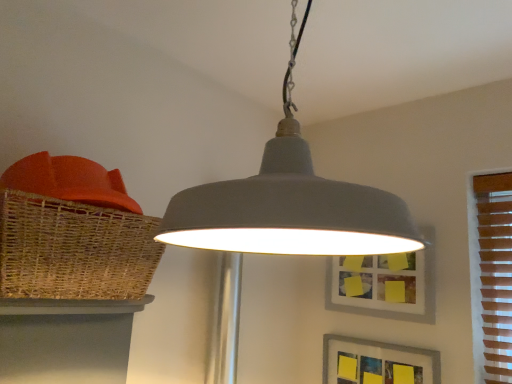
Question: Can you confirm if matte wicker table at lower left is bigger than matte gray picture frame at center, the 1th picture frame from the top?

Choices:
 (A) yes
 (B) no

Answer: (A)

Question: Is matte wicker table at lower left looking in the opposite direction of matte gray picture frame at center, the 1th picture frame from the top?

Choices:
 (A) yes
 (B) no

Answer: (B)

Question: From a real-world perspective, does matte wicker table at lower left stand above matte gray picture frame at center, the 1th picture frame from the top?

Choices:
 (A) no
 (B) yes

Answer: (A)

Question: Does matte wicker table at lower left touch matte gray picture frame at center, the second picture frame in the bottom-to-top sequence?

Choices:
 (A) yes
 (B) no

Answer: (B)

Question: Can you confirm if matte wicker table at lower left is thinner than matte gray picture frame at center, the second picture frame in the bottom-to-top sequence?

Choices:
 (A) yes
 (B) no

Answer: (B)

Question: Is the position of matte wicker table at lower left more distant than that of matte gray picture frame at center, the 1th picture frame from the top?

Choices:
 (A) yes
 (B) no

Answer: (B)

Question: From a real-world perspective, is woven brown basket at left located beneath matte gray picture frame at lower right, positioned as the first picture frame in bottom-to-top order?

Choices:
 (A) no
 (B) yes

Answer: (A)

Question: Is woven brown basket at left at the left side of matte gray picture frame at lower right, the second picture frame when ordered from top to bottom?

Choices:
 (A) yes
 (B) no

Answer: (A)

Question: Is woven brown basket at left wider than matte gray picture frame at lower right, positioned as the first picture frame in bottom-to-top order?

Choices:
 (A) yes
 (B) no

Answer: (A)

Question: Does woven brown basket at left appear on the right side of matte gray picture frame at lower right, positioned as the first picture frame in bottom-to-top order?

Choices:
 (A) no
 (B) yes

Answer: (A)

Question: Does woven brown basket at left have a smaller size compared to matte gray picture frame at lower right, positioned as the first picture frame in bottom-to-top order?

Choices:
 (A) no
 (B) yes

Answer: (A)

Question: From the image's perspective, would you say woven brown basket at left is positioned over matte gray picture frame at lower right, positioned as the first picture frame in bottom-to-top order?

Choices:
 (A) yes
 (B) no

Answer: (A)

Question: From the image's perspective, is matte gray pendant light at center beneath matte gray picture frame at center, the 1th picture frame from the top?

Choices:
 (A) no
 (B) yes

Answer: (A)